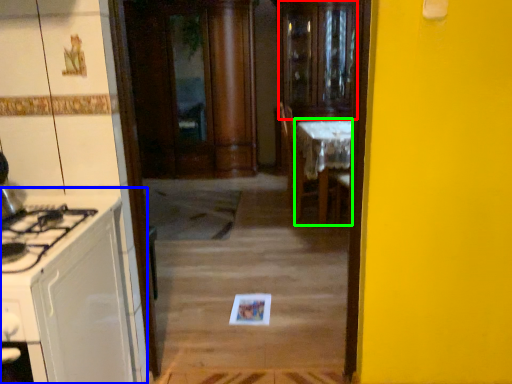
Question: Which is nearer to the glass door (highlighted by a red box)? cabinetry (highlighted by a blue box) or table (highlighted by a green box).

Choices:
 (A) cabinetry
 (B) table

Answer: (B)